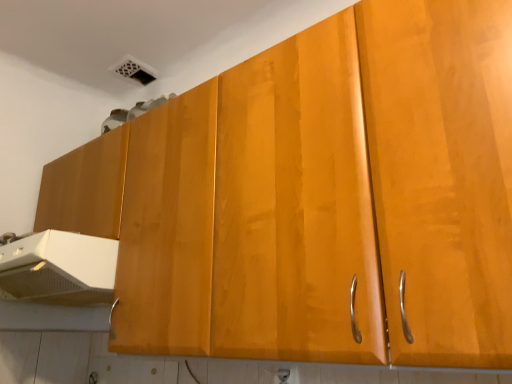
Measure the distance between white plastic vent at lower left and camera.

The depth of white plastic vent at lower left is 1.12 meters.

Locate an element on the screen. white plastic vent at lower left is located at coordinates (59, 269).

Looking at this image, what is the approximate width of white plastic vent at lower left?

white plastic vent at lower left is 22.52 inches wide.

Describe the element at coordinates (59, 269) in the screenshot. This screenshot has height=384, width=512. I see `white plastic vent at lower left` at that location.

The height and width of the screenshot is (384, 512). What are the coordinates of `white plastic vent at lower left` in the screenshot? It's located at (59, 269).